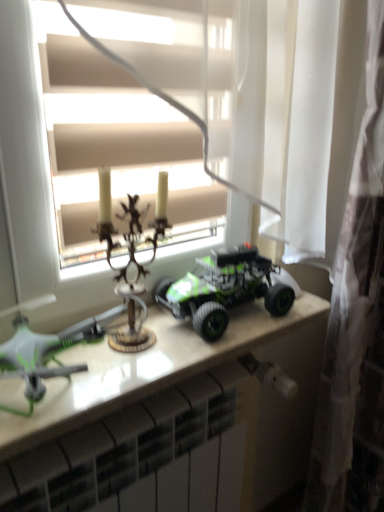
You are a GUI agent. You are given a task and a screenshot of the screen. Output one action in this format:
    pyautogui.click(x=<x>, y=<y>)
    Task: Click on the vacant space in green matte toy truck at center, positioned as the 3th toy in left-to-right order (from a real-world perspective)
    
    Given the screenshot: What is the action you would take?
    pyautogui.click(x=231, y=322)